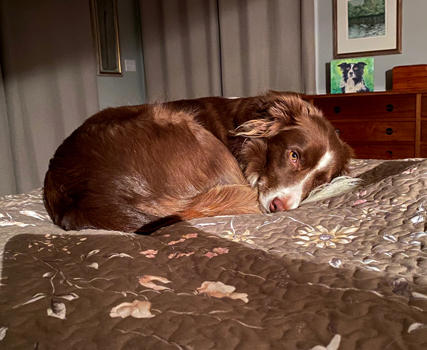
Find the location of a particular element. The width and height of the screenshot is (427, 350). drawers is located at coordinates (376, 110), (375, 127), (374, 151).